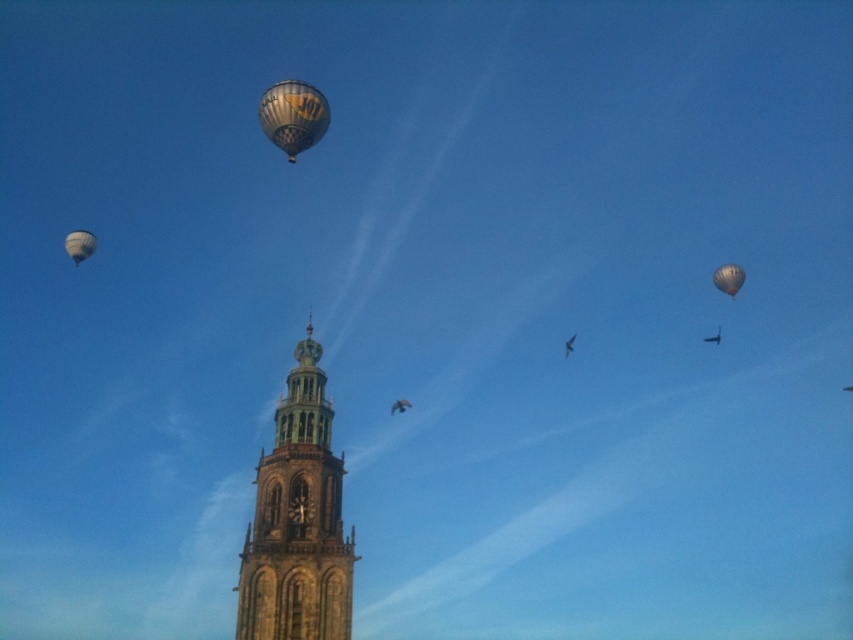
Question: Based on their relative distances, which object is farther from the matte black balloon at upper right?

Choices:
 (A) checkered fabric balloon at upper center
 (B) stone clock tower at center
 (C) matte white balloon at upper left

Answer: (C)

Question: Does stone clock tower at center appear on the right side of checkered fabric balloon at upper center?

Choices:
 (A) no
 (B) yes

Answer: (B)

Question: Does stone clock tower at center lie behind matte black balloon at upper right?

Choices:
 (A) no
 (B) yes

Answer: (A)

Question: Which object is positioned closest to the matte black balloon at upper right?

Choices:
 (A) matte white balloon at upper left
 (B) checkered fabric balloon at upper center
 (C) stone clock tower at center

Answer: (B)

Question: Is matte white balloon at upper left smaller than matte black balloon at upper right?

Choices:
 (A) yes
 (B) no

Answer: (B)

Question: Which object is the closest to the stone clock tower at center?

Choices:
 (A) checkered fabric balloon at upper center
 (B) matte black balloon at upper right

Answer: (A)